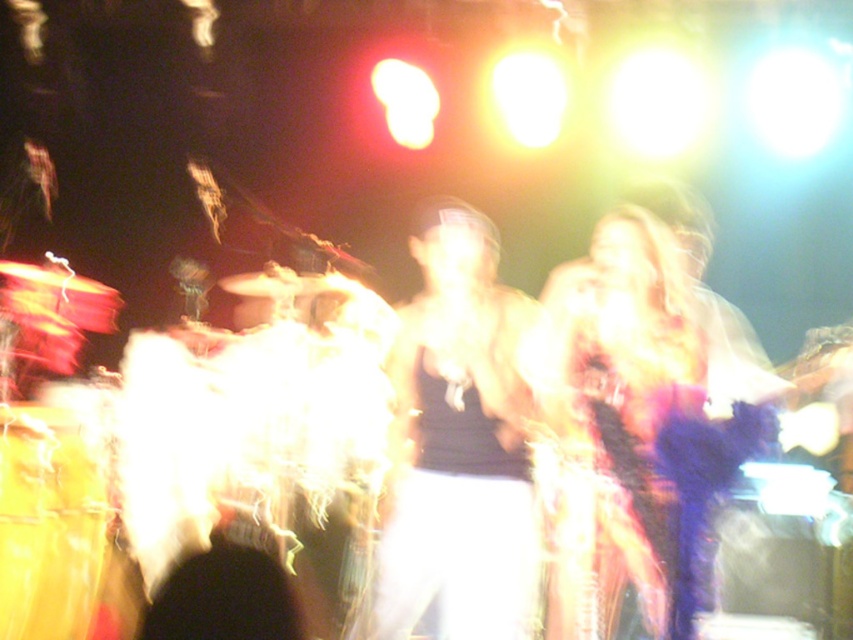
The image size is (853, 640). Identify the location of shiny purple dress at center. (625, 330).

Does shiny purple dress at center come behind shiny gold drum at lower left?

That is False.

What do you see at coordinates (625, 330) in the screenshot? This screenshot has height=640, width=853. I see `shiny purple dress at center` at bounding box center [625, 330].

Identify the location of shiny purple dress at center. Image resolution: width=853 pixels, height=640 pixels. (625, 330).